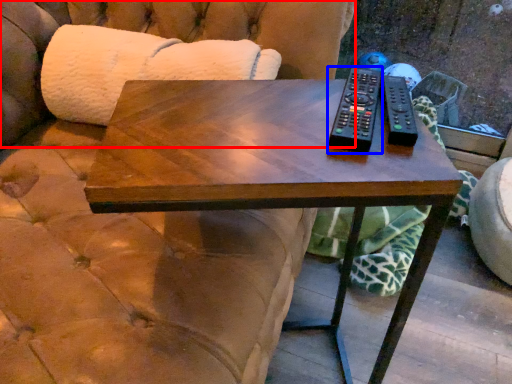
Question: Which point is further to the camera, couch (highlighted by a red box) or remote (highlighted by a blue box)?

Choices:
 (A) couch
 (B) remote

Answer: (A)